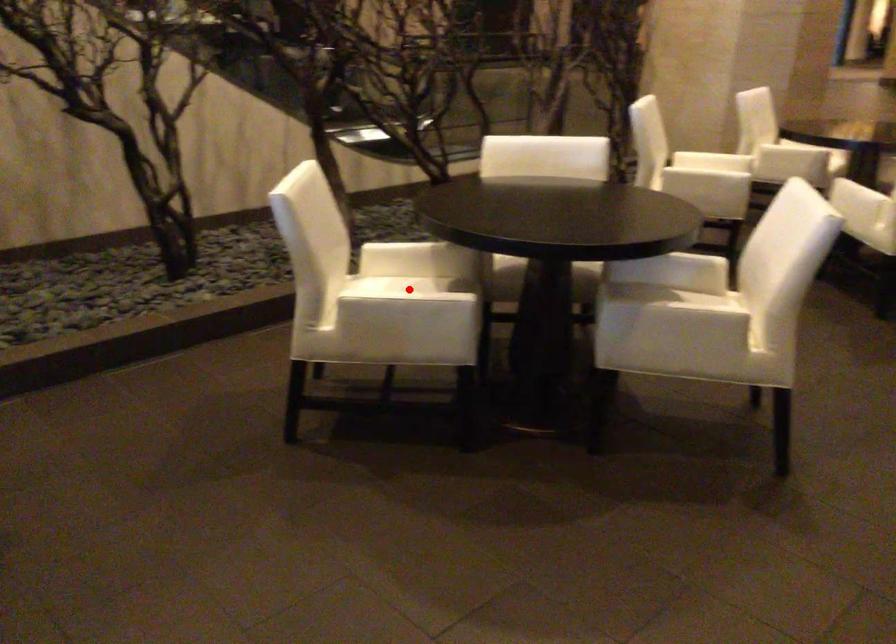
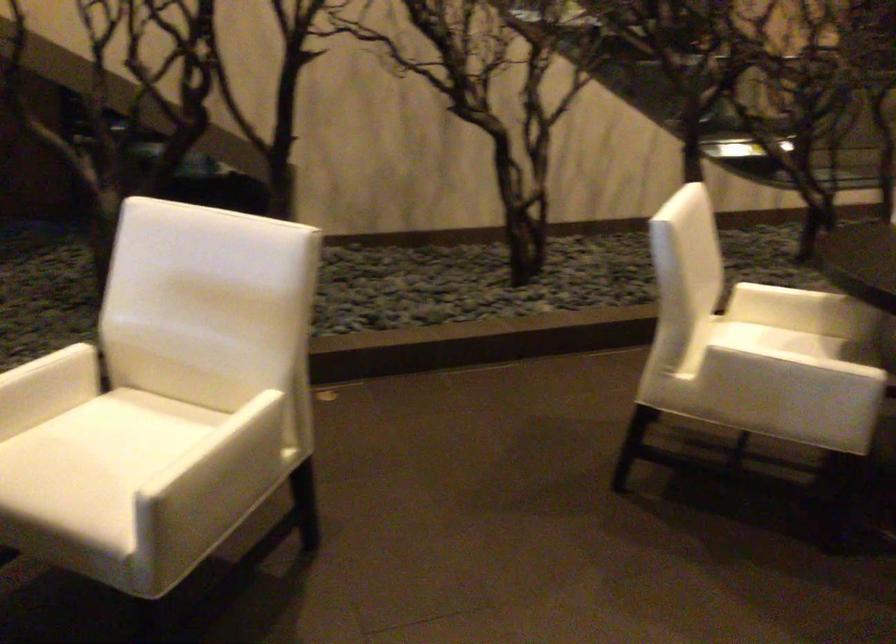
In the second image, find the point that corresponds to the highlighted location in the first image.

(791, 341)